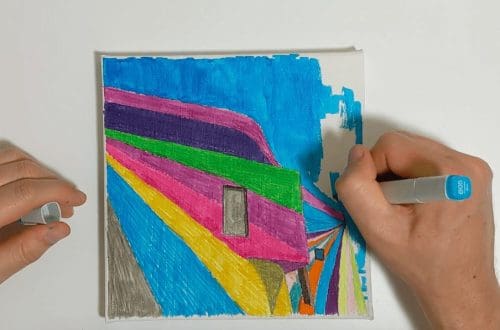
Where is `blue marker`? The height and width of the screenshot is (330, 500). blue marker is located at coordinates (455, 185).